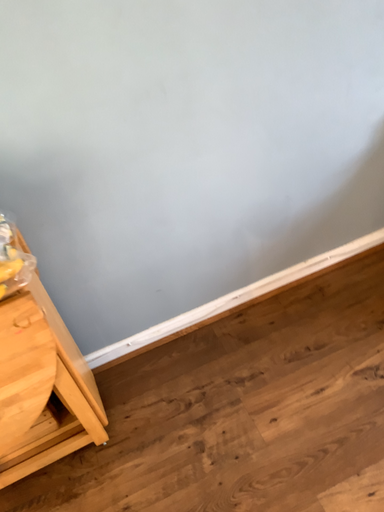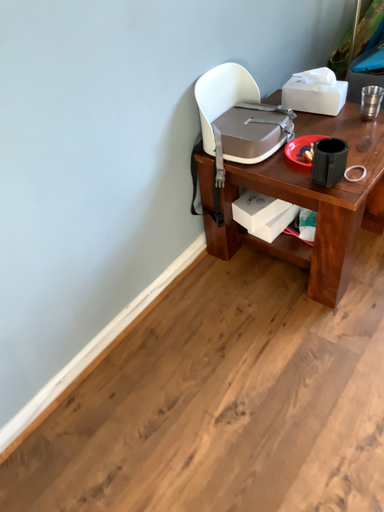
Question: Which way did the camera rotate in the video?

Choices:
 (A) rotated left
 (B) rotated right

Answer: (B)